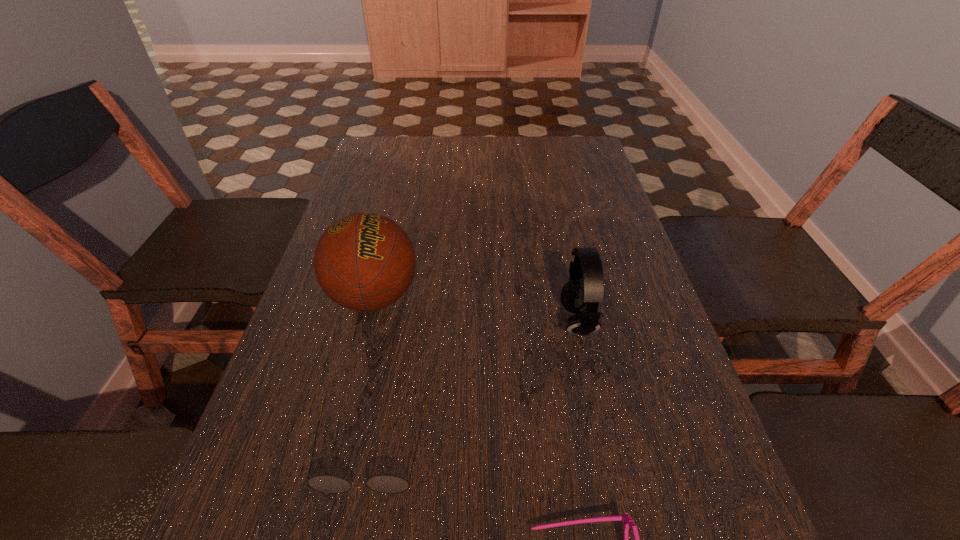
This screenshot has width=960, height=540. Identify the location of basketball. (364, 261).

Where is `the third shortest object`? This screenshot has height=540, width=960. the third shortest object is located at coordinates (585, 289).

The width and height of the screenshot is (960, 540). I want to click on the second nearest object, so click(388, 484).

This screenshot has width=960, height=540. Identify the location of the farther spectacles. (388, 484).

This screenshot has width=960, height=540. I want to click on free space located on the back of the basketball, so click(x=401, y=185).

The width and height of the screenshot is (960, 540). What are the coordinates of `free space located on the ear cups of the third shortest object` in the screenshot? It's located at (468, 321).

Where is `vacant region located 0.310m on the ear cups of the third shortest object`? This screenshot has height=540, width=960. vacant region located 0.310m on the ear cups of the third shortest object is located at coordinates 410,321.

Where is `free space located 0.180m on the ear cups of the third shortest object`? The height and width of the screenshot is (540, 960). free space located 0.180m on the ear cups of the third shortest object is located at coordinates (473, 321).

This screenshot has width=960, height=540. I want to click on basketball that is at the left edge, so click(364, 261).

The height and width of the screenshot is (540, 960). In order to click on spectacles present at the left edge in this screenshot , I will do `click(388, 484)`.